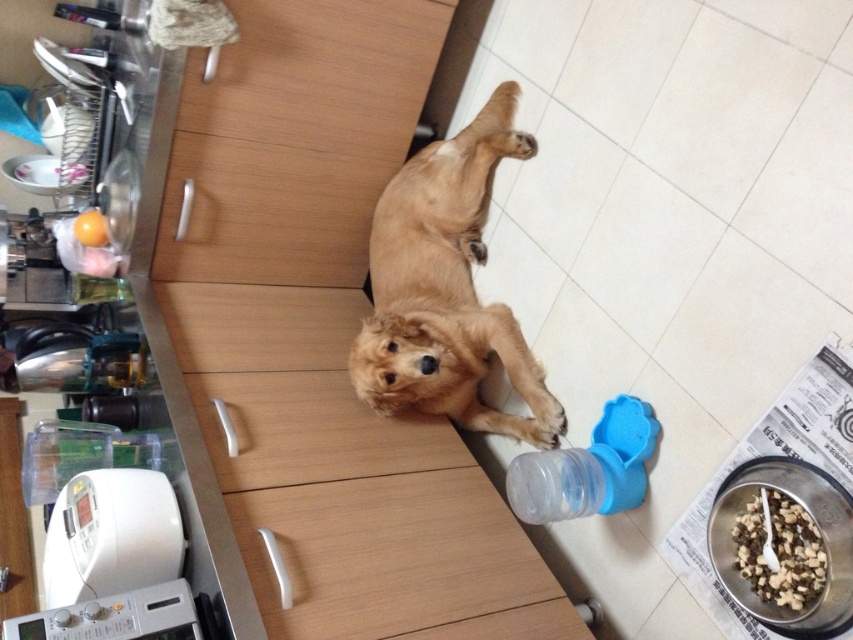
What do you see at coordinates (445, 289) in the screenshot?
I see `golden fur dog at center` at bounding box center [445, 289].

Which is behind, point (384, 346) or point (524, 513)?

The point (384, 346) is more distant.

Image resolution: width=853 pixels, height=640 pixels. What do you see at coordinates (445, 289) in the screenshot?
I see `golden fur dog at center` at bounding box center [445, 289].

Locate an element on the screen. The height and width of the screenshot is (640, 853). golden fur dog at center is located at coordinates pos(445,289).

Is golden fur dog at center in front of smooth brown kibble at lower right?

No, golden fur dog at center is behind smooth brown kibble at lower right.

Can you confirm if golden fur dog at center is positioned to the left of smooth brown kibble at lower right?

Correct, you'll find golden fur dog at center to the left of smooth brown kibble at lower right.

Does point (453, 330) come in front of point (746, 520)?

That is False.

The image size is (853, 640). Identify the location of golden fur dog at center. (445, 289).

Which is more to the left, translucent plastic bottle at lower center or smooth brown kibble at lower right?

From the viewer's perspective, translucent plastic bottle at lower center appears more on the left side.

Which is in front, point (527, 508) or point (793, 598)?

Positioned in front is point (793, 598).

Between point (621, 500) and point (807, 573), which one is positioned behind?

Point (621, 500)

Locate an element on the screen. translucent plastic bottle at lower center is located at coordinates pyautogui.click(x=587, y=468).